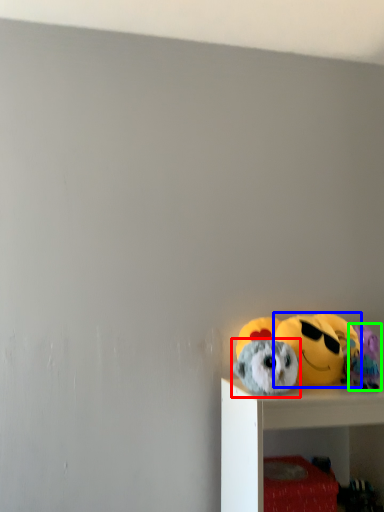
Question: Which object is the farthest from toy (highlighted by a red box)? Choose among these: toy (highlighted by a blue box) or toy (highlighted by a green box).

Choices:
 (A) toy
 (B) toy

Answer: (B)